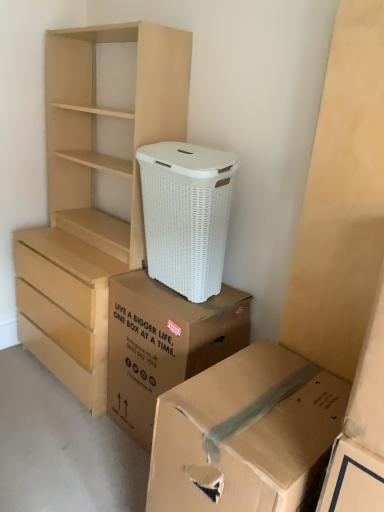
Question: Relative to white wicker laundry basket at center, is light brown wood chest of drawers at left in front or behind?

Choices:
 (A) behind
 (B) front

Answer: (A)

Question: Is light brown wood chest of drawers at left inside the boundaries of white wicker laundry basket at center, or outside?

Choices:
 (A) outside
 (B) inside

Answer: (A)

Question: Which object is positioned farthest from the cardboard box at lower right, the 1th box from the front?

Choices:
 (A) light brown wood chest of drawers at left
 (B) brown cardboard box at lower center, which is the second box from front to back
 (C) white wicker laundry basket at center

Answer: (A)

Question: Which object is positioned closest to the cardboard box at lower right, acting as the second box starting from the back?

Choices:
 (A) light brown wood chest of drawers at left
 (B) white wicker laundry basket at center
 (C) brown cardboard box at lower center, which is the second box from front to back

Answer: (C)